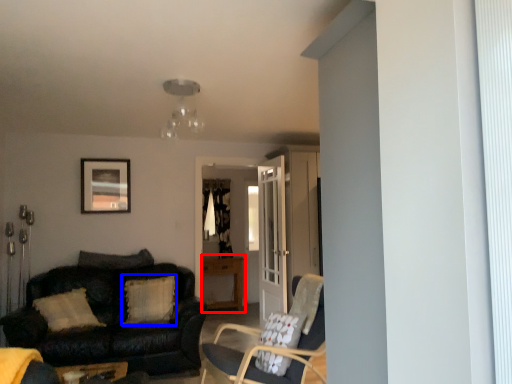
Question: Among these objects, which one is farthest to the camera, table (highlighted by a red box) or pillow (highlighted by a blue box)?

Choices:
 (A) table
 (B) pillow

Answer: (A)